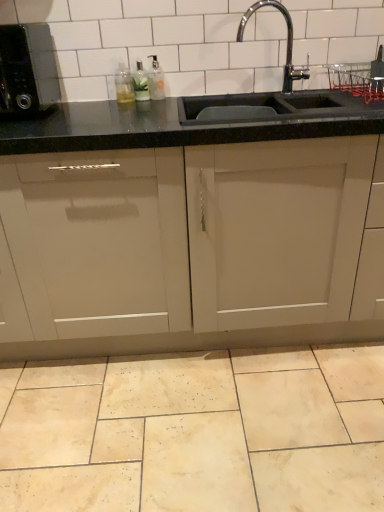
Question: In the image, is beige marble tile at lower center positioned in front of or behind matte beige cabinet at center?

Choices:
 (A) front
 (B) behind

Answer: (A)

Question: Is beige marble tile at lower center wider or thinner than matte beige cabinet at center?

Choices:
 (A) wide
 (B) thin

Answer: (A)

Question: Estimate the real-world distances between objects in this image. Which object is closer to the black matte microwave at left?

Choices:
 (A) black granite sink at upper center
 (B) matte beige cabinet at center
 (C) clear glass bottle at upper center, which is the first bottle from right to left
 (D) beige marble tile at lower center
 (E) translucent glass bottle at upper left, arranged as the second bottle when viewed from the left

Answer: (E)

Question: Which is farther from the black granite sink at upper center?

Choices:
 (A) translucent plastic bottle at upper left, the 3th bottle positioned from the right
 (B) black matte microwave at left
 (C) translucent glass bottle at upper left, arranged as the second bottle when viewed from the left
 (D) beige marble tile at lower center
 (E) matte beige cabinet at center

Answer: (D)